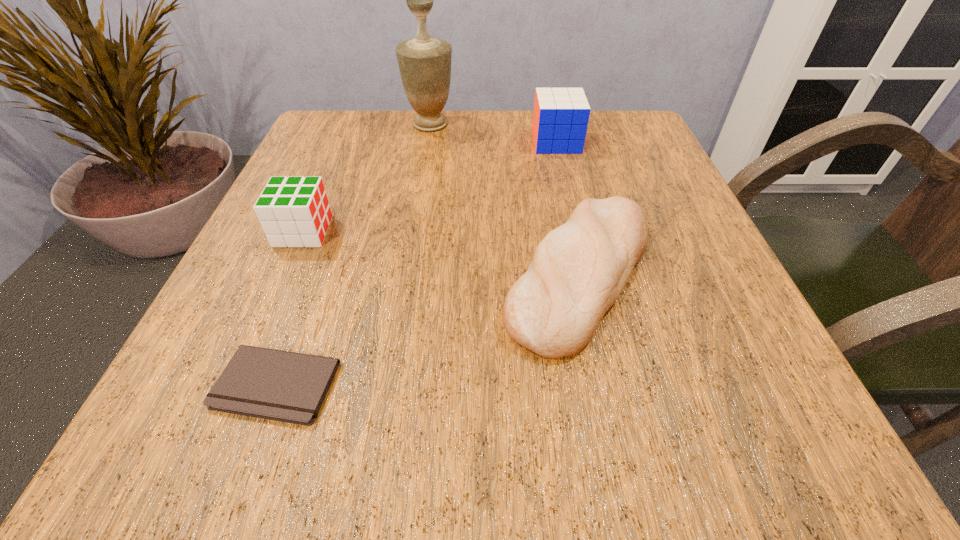
This screenshot has height=540, width=960. Identify the location of vacant region that satisfies the following two spatial constraints: 1. on the red face of the nearer cube; 2. on the back side of the bread. [x=284, y=275].

Image resolution: width=960 pixels, height=540 pixels. Find the location of `vacant area in the image that satisfies the following two spatial constraints: 1. on the back side of the bread; 2. on the right side of the fourth shortest object`. vacant area in the image that satisfies the following two spatial constraints: 1. on the back side of the bread; 2. on the right side of the fourth shortest object is located at coordinates point(551,142).

Locate an element on the screen. The width and height of the screenshot is (960, 540). free space that satisfies the following two spatial constraints: 1. on the red face of the bread; 2. on the right side of the shorter cube is located at coordinates (284, 275).

Find the location of a particular element. This screenshot has width=960, height=540. vacant space that satisfies the following two spatial constraints: 1. on the red face of the left cube; 2. on the right side of the bread is located at coordinates (284, 275).

Where is `vacant space that satisfies the following two spatial constraints: 1. on the front side of the farther cube; 2. on the red face of the left cube`? This screenshot has width=960, height=540. vacant space that satisfies the following two spatial constraints: 1. on the front side of the farther cube; 2. on the red face of the left cube is located at coordinates (578, 232).

Locate an element on the screen. This screenshot has width=960, height=540. free location that satisfies the following two spatial constraints: 1. on the back side of the farther cube; 2. on the left side of the checkbook is located at coordinates (364, 142).